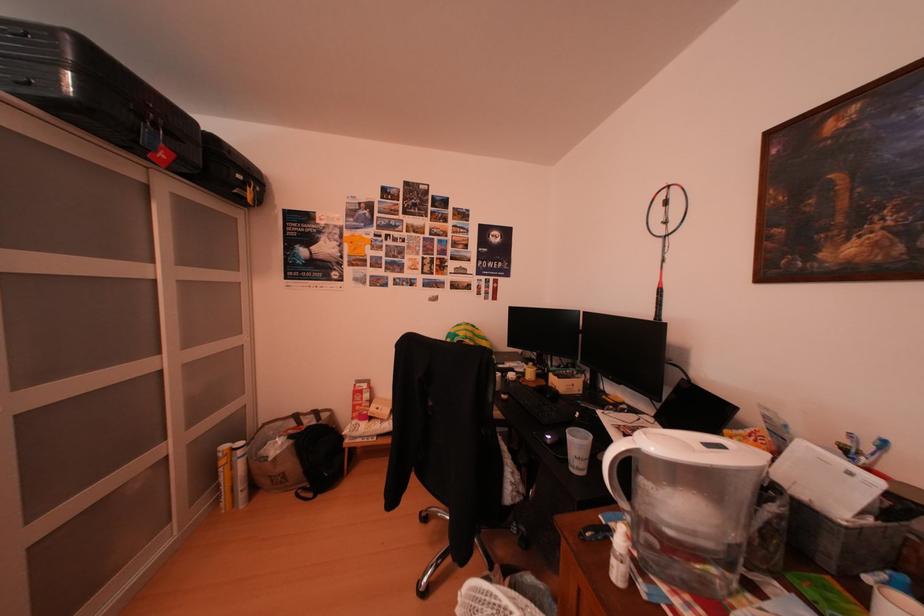
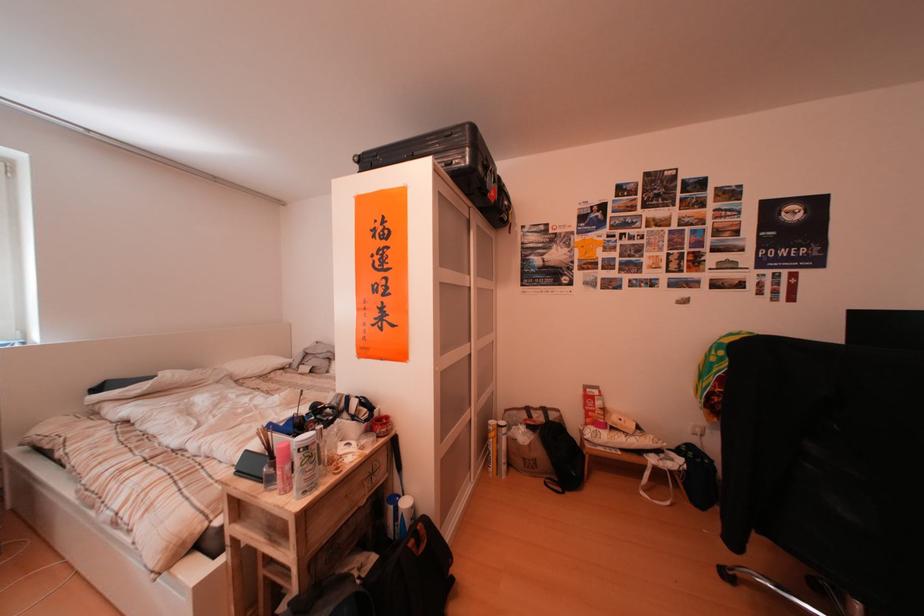
Find the pixel in the second image that matches [366,424] in the first image.

(599, 430)